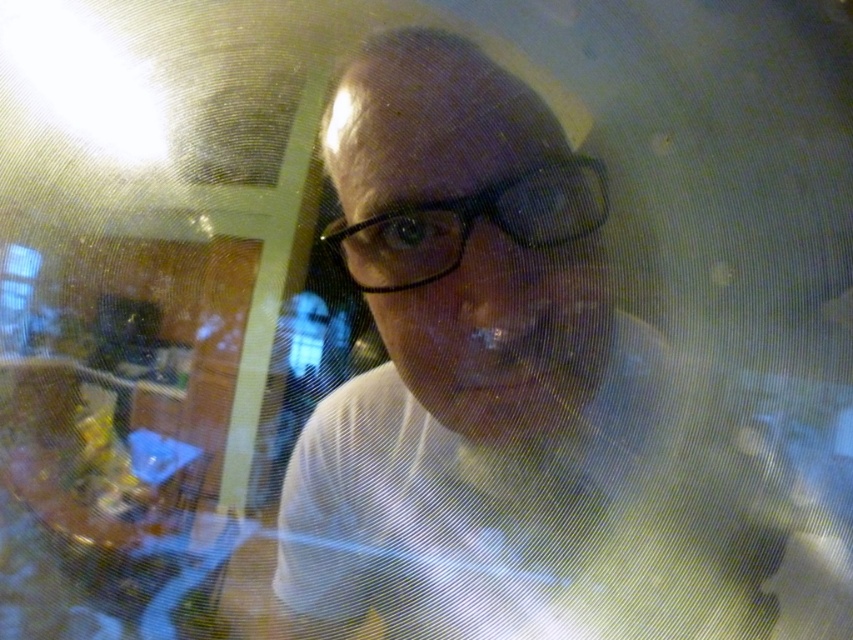
Is white matte shirt at center further to camera compared to black plastic glasses at center?

That is False.

Which is more to the right, white matte shirt at center or black plastic glasses at center?

black plastic glasses at center

Is point (686, 371) closer to camera compared to point (598, 180)?

Yes.

Locate an element on the screen. The image size is (853, 640). white matte shirt at center is located at coordinates (496, 396).